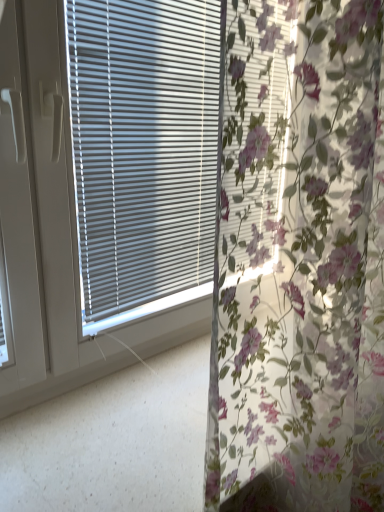
Question: Considering the relative sizes of floral fabric curtain at center and matte gray blinds at center in the image provided, is floral fabric curtain at center smaller than matte gray blinds at center?

Choices:
 (A) yes
 (B) no

Answer: (B)

Question: From a real-world perspective, does floral fabric curtain at center sit lower than matte gray blinds at center?

Choices:
 (A) yes
 (B) no

Answer: (A)

Question: Considering the relative sizes of floral fabric curtain at center and matte gray blinds at center in the image provided, is floral fabric curtain at center taller than matte gray blinds at center?

Choices:
 (A) no
 (B) yes

Answer: (B)

Question: Is the depth of floral fabric curtain at center less than that of matte gray blinds at center?

Choices:
 (A) yes
 (B) no

Answer: (A)

Question: Does floral fabric curtain at center touch matte gray blinds at center?

Choices:
 (A) no
 (B) yes

Answer: (A)

Question: Is floral fabric curtain at center oriented away from matte gray blinds at center?

Choices:
 (A) yes
 (B) no

Answer: (A)

Question: Could you tell me if matte gray blinds at center is turned towards floral fabric curtain at center?

Choices:
 (A) yes
 (B) no

Answer: (A)

Question: Is floral fabric curtain at center completely or partially inside matte gray blinds at center?

Choices:
 (A) yes
 (B) no

Answer: (B)

Question: Is matte gray blinds at center wider than floral fabric curtain at center?

Choices:
 (A) yes
 (B) no

Answer: (B)

Question: Is matte gray blinds at center beside floral fabric curtain at center?

Choices:
 (A) yes
 (B) no

Answer: (B)

Question: Does matte gray blinds at center have a greater height compared to floral fabric curtain at center?

Choices:
 (A) yes
 (B) no

Answer: (B)

Question: Considering the relative sizes of matte gray blinds at center and floral fabric curtain at center in the image provided, is matte gray blinds at center bigger than floral fabric curtain at center?

Choices:
 (A) yes
 (B) no

Answer: (B)

Question: From the image's perspective, relative to floral fabric curtain at center, is matte gray blinds at center above or below?

Choices:
 (A) below
 (B) above

Answer: (B)